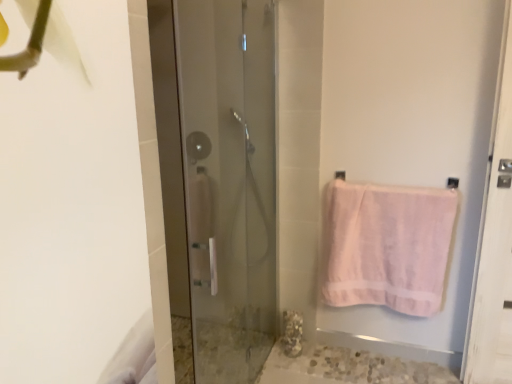
Where is `pink cotton towel at right`? The width and height of the screenshot is (512, 384). pink cotton towel at right is located at coordinates (386, 246).

You are a GUI agent. You are given a task and a screenshot of the screen. Output one action in this format:
    pyautogui.click(x=<x>, y=<y>)
    Task: Click on the transparent glass shower door at center
    
    Given the screenshot: What is the action you would take?
    pyautogui.click(x=230, y=182)

The image size is (512, 384). What are the coordinates of `pink cotton towel at right` in the screenshot? It's located at (386, 246).

Considering the sizes of objects pink cotton towel at right and transparent glass shower door at center in the image provided, who is taller, pink cotton towel at right or transparent glass shower door at center?

Standing taller between the two is transparent glass shower door at center.

Looking at the image, does pink cotton towel at right seem bigger or smaller compared to transparent glass shower door at center?

Clearly, pink cotton towel at right is smaller in size than transparent glass shower door at center.

Could you tell me if pink cotton towel at right is facing transparent glass shower door at center?

No.

How different are the orientations of pink cotton towel at right and transparent glass shower door at center in degrees?

The angle between the facing direction of pink cotton towel at right and the facing direction of transparent glass shower door at center is 95.6 degrees.

Does transparent glass shower door at center have a greater width compared to clear glass shower at center?

Correct, the width of transparent glass shower door at center exceeds that of clear glass shower at center.

Is transparent glass shower door at center facing away from clear glass shower at center?

That's right, transparent glass shower door at center is facing away from clear glass shower at center.

In the image, is transparent glass shower door at center positioned in front of or behind clear glass shower at center?

transparent glass shower door at center is in front of clear glass shower at center.

Considering the relative sizes of transparent glass shower door at center and pink cotton towel at right in the image provided, is transparent glass shower door at center taller than pink cotton towel at right?

Correct, transparent glass shower door at center is much taller as pink cotton towel at right.

Which object is positioned more to the right, transparent glass shower door at center or pink cotton towel at right?

pink cotton towel at right.

What's the angular difference between transparent glass shower door at center and pink cotton towel at right's facing directions?

There is a 95.6-degree angle between the facing directions of transparent glass shower door at center and pink cotton towel at right.

Find the location of a particular element. Image resolution: width=512 pixels, height=384 pixels. door on the left of pink cotton towel at right is located at coordinates (230, 182).

Would you say clear glass shower at center is part of pink cotton towel at right's contents?

No, clear glass shower at center is located outside of pink cotton towel at right.

Is pink cotton towel at right placed right next to clear glass shower at center?

There is a gap between pink cotton towel at right and clear glass shower at center.

Where is `towel beneath the clear glass shower at center (from a real-world perspective)`? towel beneath the clear glass shower at center (from a real-world perspective) is located at coordinates (386, 246).

Considering the positions of point (361, 275) and point (188, 146), is point (361, 275) closer or farther from the camera than point (188, 146)?

Point (361, 275) is positioned closer to the camera compared to point (188, 146).

Consider the image. How far apart are clear glass shower at center and pink cotton towel at right?

clear glass shower at center is 3.45 feet away from pink cotton towel at right.

Is clear glass shower at center wider than pink cotton towel at right?

No.

Considering the points (201, 139) and (354, 190), which point is in front, point (201, 139) or point (354, 190)?

Point (354, 190)

Image resolution: width=512 pixels, height=384 pixels. In order to click on shower positioned vertically above the pink cotton towel at right (from a real-world perspective) in this screenshot , I will do `click(198, 146)`.

Is clear glass shower at center oriented towards transparent glass shower door at center?

No, clear glass shower at center is not oriented towards transparent glass shower door at center.

Does clear glass shower at center touch transparent glass shower door at center?

No, clear glass shower at center is not in contact with transparent glass shower door at center.

Which of these two, clear glass shower at center or transparent glass shower door at center, is thinner?

Thinner between the two is clear glass shower at center.

Where is `door in front of the pink cotton towel at right`? The width and height of the screenshot is (512, 384). door in front of the pink cotton towel at right is located at coordinates (230, 182).

What are the coordinates of `door that is under the clear glass shower at center (from a real-world perspective)` in the screenshot? It's located at (230, 182).

Estimate the real-world distances between objects in this image. Which object is closer to pink cotton towel at right, clear glass shower at center or transparent glass shower door at center?

transparent glass shower door at center.

Looking at the image, which one is located closer to pink cotton towel at right, transparent glass shower door at center or clear glass shower at center?

transparent glass shower door at center.

Estimate the real-world distances between objects in this image. Which object is further from transparent glass shower door at center, pink cotton towel at right or clear glass shower at center?

Among the two, pink cotton towel at right is located further to transparent glass shower door at center.

Looking at the image, which one is located closer to clear glass shower at center, transparent glass shower door at center or pink cotton towel at right?

transparent glass shower door at center is positioned closer to the anchor clear glass shower at center.

Which object lies further to the anchor point transparent glass shower door at center, clear glass shower at center or pink cotton towel at right?

Among the two, pink cotton towel at right is located further to transparent glass shower door at center.

Estimate the real-world distances between objects in this image. Which object is further from clear glass shower at center, pink cotton towel at right or transparent glass shower door at center?

pink cotton towel at right is positioned further to the anchor clear glass shower at center.

Where is `towel between transparent glass shower door at center and clear glass shower at center from front to back`? The width and height of the screenshot is (512, 384). towel between transparent glass shower door at center and clear glass shower at center from front to back is located at coordinates (386, 246).